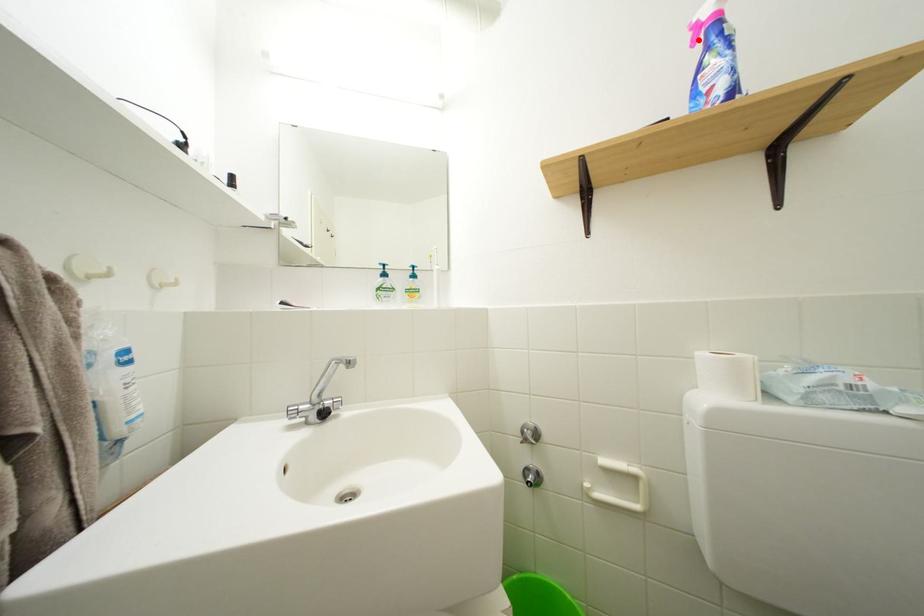
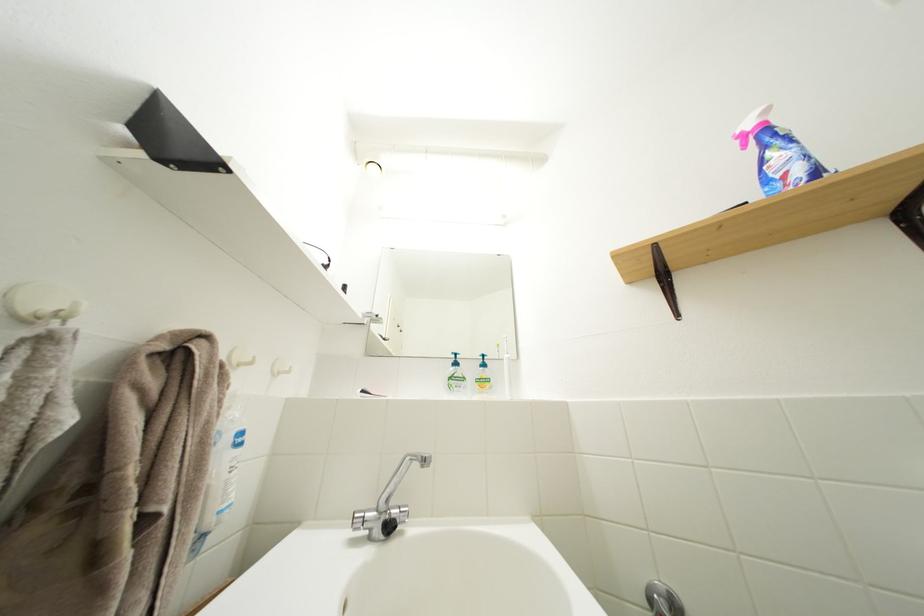
Locate, in the second image, the point that corresponds to the highlighted location in the first image.

(746, 148)